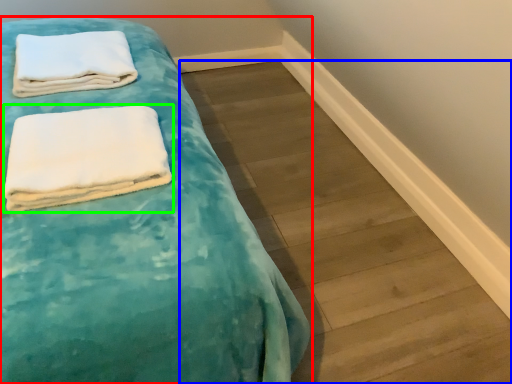
Question: Based on their relative distances, which object is nearer to bed (highlighted by a red box)? Choose from plank (highlighted by a blue box) and towel (highlighted by a green box).

Choices:
 (A) plank
 (B) towel

Answer: (B)